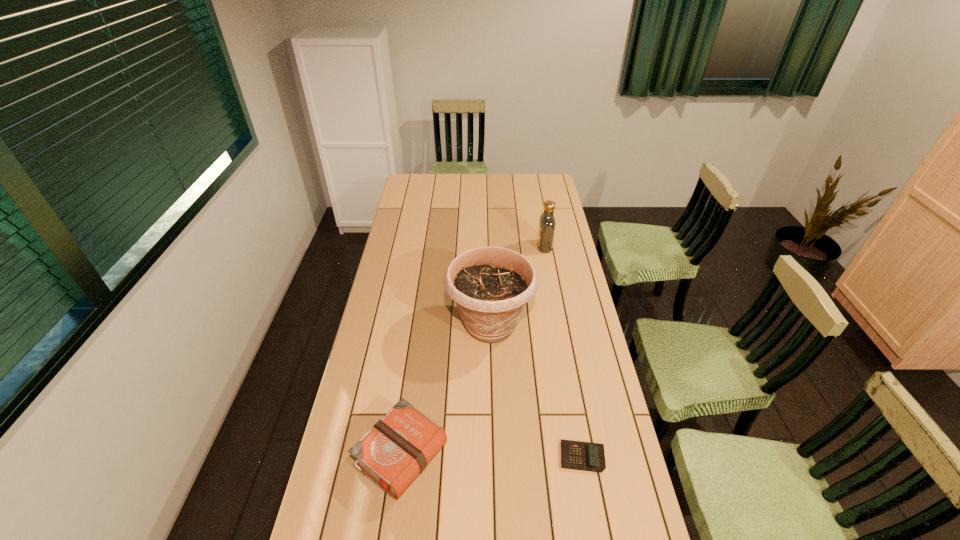
At what (x,y) coordinates should I click in order to perform the action: click on object that is at the left edge. Please return your answer as a coordinate pair (x, y). The image size is (960, 540). Looking at the image, I should click on (397, 449).

What are the coordinates of `vodka at the right edge` in the screenshot? It's located at (546, 230).

Locate an element on the screen. Image resolution: width=960 pixels, height=540 pixels. calculator that is at the right edge is located at coordinates (586, 456).

The height and width of the screenshot is (540, 960). In order to click on free space at the left edge of the desktop in this screenshot , I will do `click(390, 237)`.

Locate an element on the screen. blank space at the right edge is located at coordinates (579, 316).

In the image, there is a desktop. Where is `vacant space at the far left corner`? vacant space at the far left corner is located at coordinates (419, 182).

Locate an element on the screen. The width and height of the screenshot is (960, 540). vacant area that lies between the calculator and the farthest object is located at coordinates (564, 352).

The width and height of the screenshot is (960, 540). Identify the location of empty space between the Bible and the calculator. (492, 456).

Locate an element on the screen. This screenshot has width=960, height=540. free space between the second farthest object and the shortest object is located at coordinates (536, 391).

Identify the location of free area in between the third nearest object and the Bible. This screenshot has width=960, height=540. (445, 390).